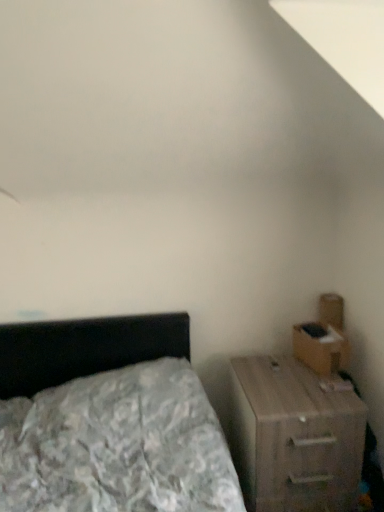
This screenshot has width=384, height=512. Find the location of `wooden nightstand at right`. wooden nightstand at right is located at coordinates (294, 436).

What do you see at coordinates (294, 436) in the screenshot? The width and height of the screenshot is (384, 512). I see `wooden nightstand at right` at bounding box center [294, 436].

At what (x,y) coordinates should I click in order to perform the action: click on brown cardboard drawer at right. Please return your answer as a coordinate pair (x, y). This screenshot has width=384, height=512. Looking at the image, I should click on (320, 347).

What do you see at coordinates (320, 347) in the screenshot? Image resolution: width=384 pixels, height=512 pixels. I see `brown cardboard drawer at right` at bounding box center [320, 347].

Identify the location of wooden nightstand at right. Image resolution: width=384 pixels, height=512 pixels. (294, 436).

Can you confirm if wooden nightstand at right is positioned to the left of brown cardboard drawer at right?

Correct, you'll find wooden nightstand at right to the left of brown cardboard drawer at right.

Considering the relative positions of wooden nightstand at right and brown cardboard drawer at right in the image provided, is wooden nightstand at right in front of brown cardboard drawer at right?

Yes, wooden nightstand at right is closer to the viewer.

Between point (283, 430) and point (295, 325), which one is positioned behind?

The point (295, 325) is behind.

Looking at this image, from the image's perspective, which one is positioned lower, wooden nightstand at right or brown cardboard drawer at right?

wooden nightstand at right, from the image's perspective.

Looking at this image, from a real-world perspective, relative to brown cardboard drawer at right, is wooden nightstand at right vertically above or below?

wooden nightstand at right is below brown cardboard drawer at right.

Considering the relative sizes of wooden nightstand at right and brown cardboard drawer at right in the image provided, is wooden nightstand at right wider than brown cardboard drawer at right?

Correct, the width of wooden nightstand at right exceeds that of brown cardboard drawer at right.

Consider the image. Is wooden nightstand at right taller or shorter than brown cardboard drawer at right?

Clearly, wooden nightstand at right is taller compared to brown cardboard drawer at right.

Considering the sizes of objects wooden nightstand at right and brown cardboard drawer at right in the image provided, who is bigger, wooden nightstand at right or brown cardboard drawer at right?

wooden nightstand at right is bigger.

Is wooden nightstand at right not within brown cardboard drawer at right?

Yes.

Is wooden nightstand at right not close to brown cardboard drawer at right?

They are positioned close to each other.

Could you tell me if wooden nightstand at right is turned towards brown cardboard drawer at right?

No, wooden nightstand at right is not turned towards brown cardboard drawer at right.

The width and height of the screenshot is (384, 512). I want to click on drawer that is above the wooden nightstand at right (from the image's perspective), so click(320, 347).

Is brown cardboard drawer at right to the left of wooden nightstand at right from the viewer's perspective?

No, brown cardboard drawer at right is not to the left of wooden nightstand at right.

Is brown cardboard drawer at right in front of or behind wooden nightstand at right in the image?

In the image, brown cardboard drawer at right appears behind wooden nightstand at right.

In the scene shown: Which point is more forward, (315, 365) or (294, 490)?

The point (294, 490) is in front.

Consider the image. From the image's perspective, is brown cardboard drawer at right above or below wooden nightstand at right?

From the image's perspective, brown cardboard drawer at right appears above wooden nightstand at right.

From a real-world perspective, is brown cardboard drawer at right located higher than wooden nightstand at right?

Yes, from a real-world perspective, brown cardboard drawer at right is over wooden nightstand at right

Which object is thinner, brown cardboard drawer at right or wooden nightstand at right?

With smaller width is brown cardboard drawer at right.

Considering the relative sizes of brown cardboard drawer at right and wooden nightstand at right in the image provided, is brown cardboard drawer at right shorter than wooden nightstand at right?

Correct, brown cardboard drawer at right is not as tall as wooden nightstand at right.

Does brown cardboard drawer at right have a smaller size compared to wooden nightstand at right?

Yes, brown cardboard drawer at right is smaller than wooden nightstand at right.

Is wooden nightstand at right located within brown cardboard drawer at right?

No, wooden nightstand at right is not a part of brown cardboard drawer at right.

Is the surface of brown cardboard drawer at right in direct contact with wooden nightstand at right?

There is a gap between brown cardboard drawer at right and wooden nightstand at right.

Is brown cardboard drawer at right facing away from wooden nightstand at right?

brown cardboard drawer at right does not have its back to wooden nightstand at right.

You are a GUI agent. You are given a task and a screenshot of the screen. Output one action in this format:
    pyautogui.click(x=<x>, y=<y>)
    Task: Click on the nightstand below the brown cardboard drawer at right (from a real-world perspective)
    
    Given the screenshot: What is the action you would take?
    pyautogui.click(x=294, y=436)

The image size is (384, 512). Identify the location of drawer located behind the wooden nightstand at right. (320, 347).

Where is `drawer above the wooden nightstand at right (from the image's perspective)`? The width and height of the screenshot is (384, 512). drawer above the wooden nightstand at right (from the image's perspective) is located at coordinates (320, 347).